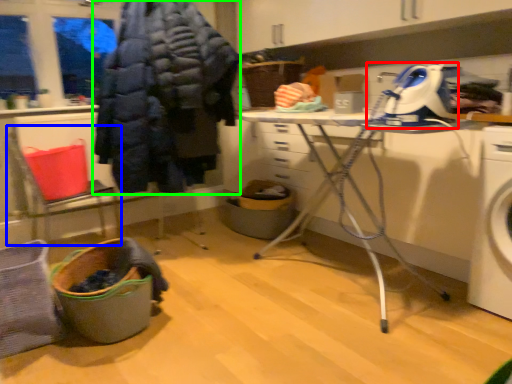
Question: Considering the real-world distances, which object is closest to sewing machine (highlighted by a red box)? chair (highlighted by a blue box) or clothing (highlighted by a green box).

Choices:
 (A) chair
 (B) clothing

Answer: (B)